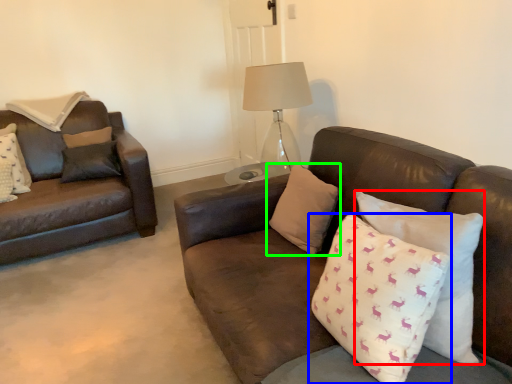
Question: Estimate the real-world distances between objects in this image. Which object is farther from pillow (highlighted by a red box), pillow (highlighted by a blue box) or pillow (highlighted by a green box)?

Choices:
 (A) pillow
 (B) pillow

Answer: (B)